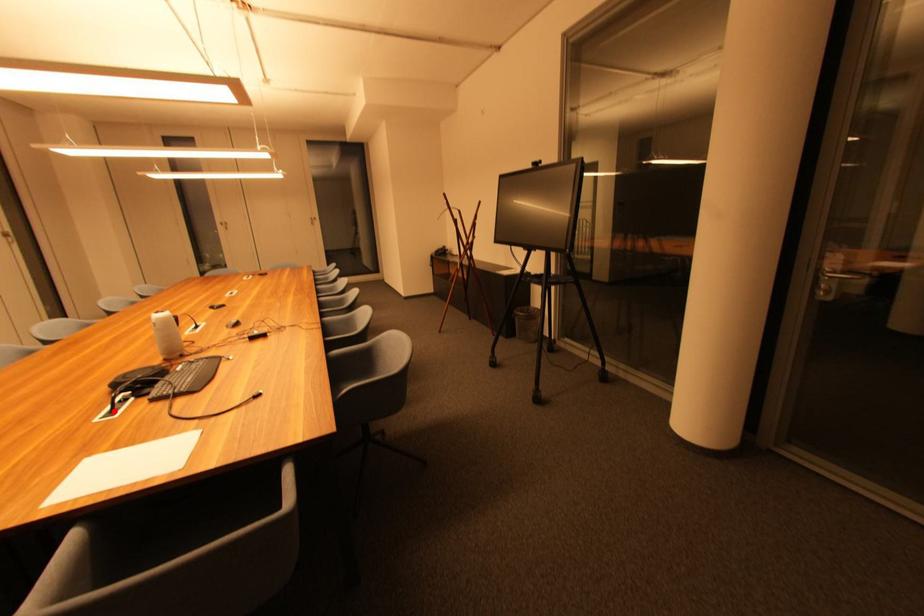
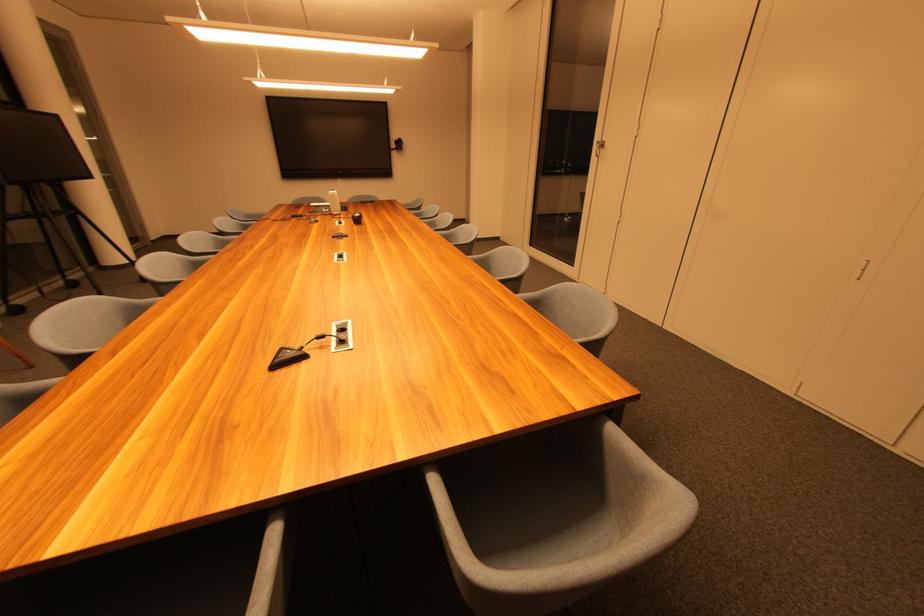
Question: I am providing you with two images of the same scene from different viewpoints. A red point is marked on the first image. At the location where the point appears in image 1, is it still visible in image 2?

Choices:
 (A) Yes
 (B) No

Answer: (B)